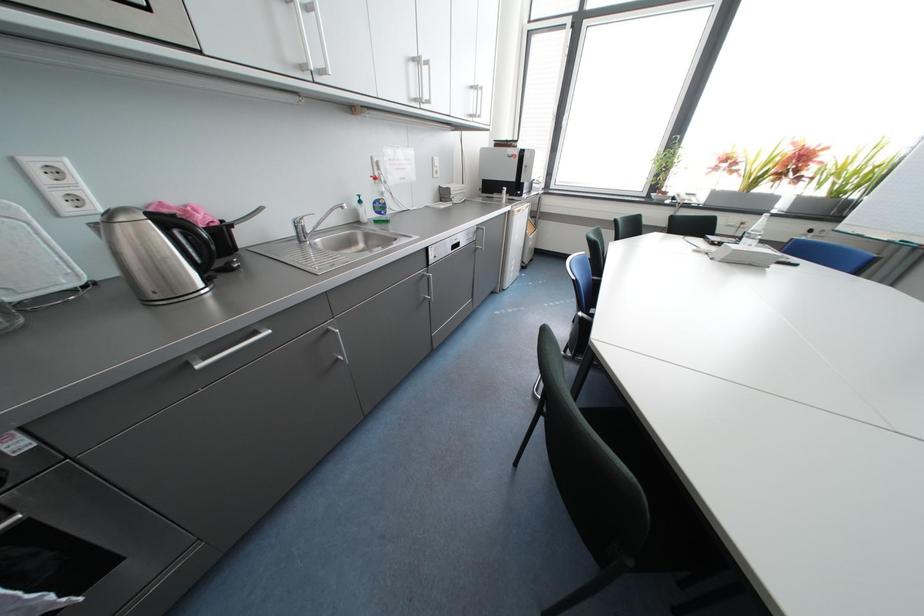
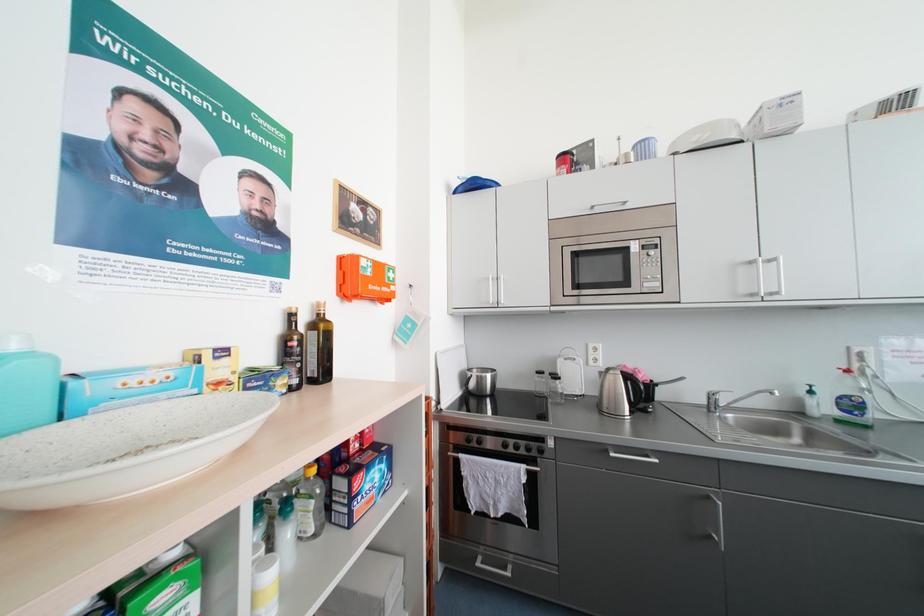
Question: The camera is either moving clockwise (left) or counter-clockwise (right) around the object. The first image is from the beginning of the video and the second image is from the end. Is the camera moving left or right when shooting the video?

Choices:
 (A) Left
 (B) Right

Answer: (B)